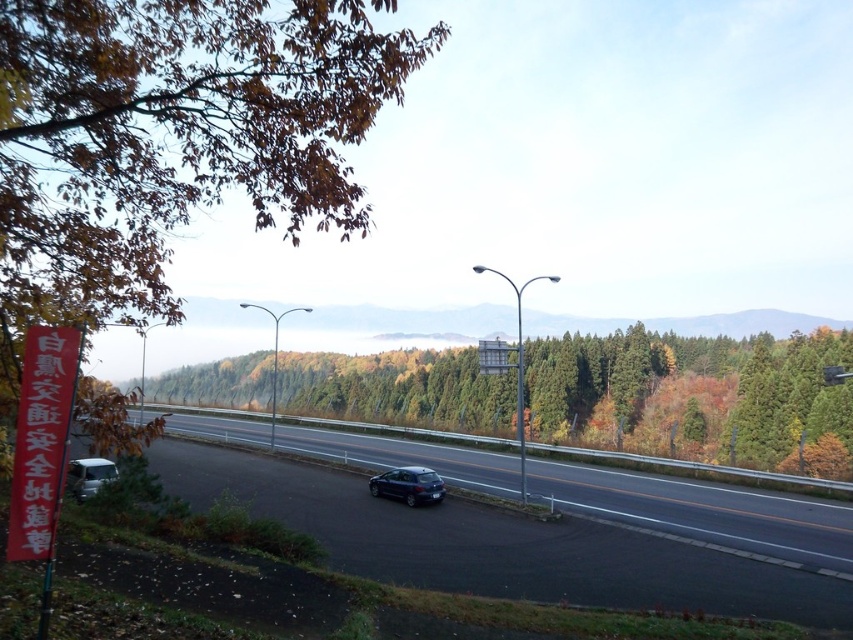
Question: Does green matte tree at center have a greater width compared to satin black hatchback at center?

Choices:
 (A) yes
 (B) no

Answer: (A)

Question: Which object appears farthest from the camera in this image?

Choices:
 (A) satin black hatchback at center
 (B) green matte tree at center
 (C) metallic silver van at lower left

Answer: (B)

Question: Among these objects, which one is farthest from the camera?

Choices:
 (A) brown leafy tree at upper left
 (B) green matte tree at center

Answer: (B)

Question: Does brown leafy tree at upper left appear over black asphalt highway at center?

Choices:
 (A) yes
 (B) no

Answer: (A)

Question: Among these points, which one is nearest to the camera?

Choices:
 (A) (90, 481)
 (B) (64, 4)
 (C) (660, 340)

Answer: (B)

Question: Does black asphalt highway at center come in front of metallic silver van at lower left?

Choices:
 (A) yes
 (B) no

Answer: (A)